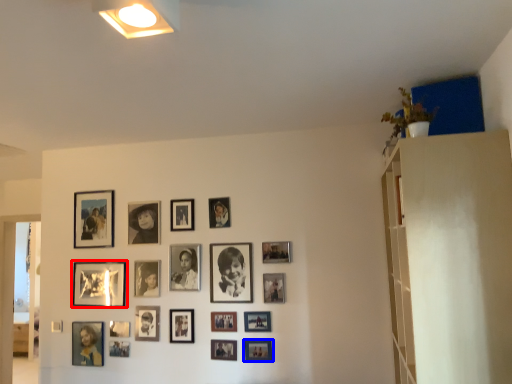
Question: Which point is further to the camera, picture frame (highlighted by a red box) or picture frame (highlighted by a blue box)?

Choices:
 (A) picture frame
 (B) picture frame

Answer: (A)